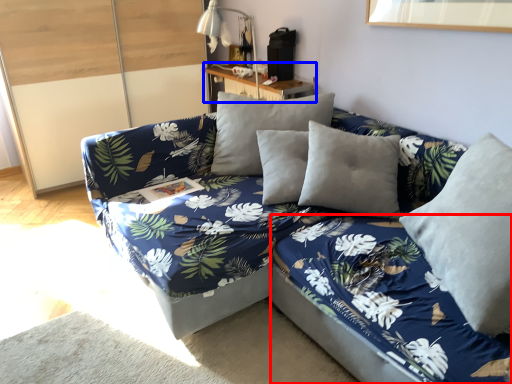
Question: Which object is further to the camera taking this photo, bed frame (highlighted by a red box) or table (highlighted by a blue box)?

Choices:
 (A) bed frame
 (B) table

Answer: (B)